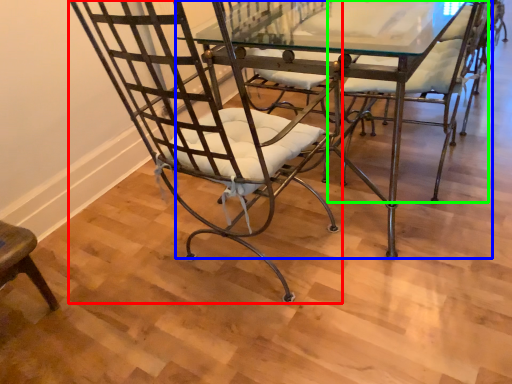
Question: Which object is the farthest from chair (highlighted by a red box)? Choose among these: table (highlighted by a blue box) or chair (highlighted by a green box).

Choices:
 (A) table
 (B) chair

Answer: (A)